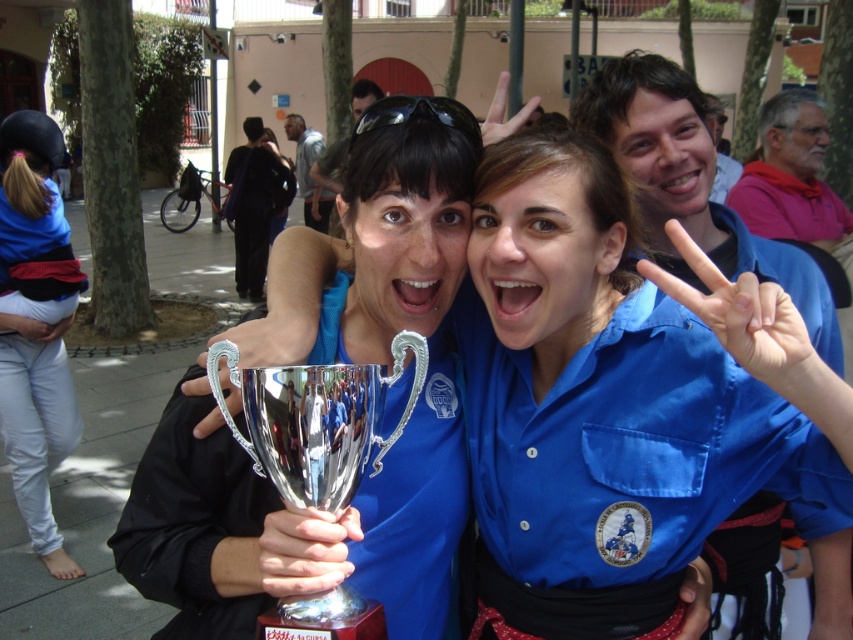
You are a photographer trying to capture a clear photo of the metallic trophy at center and the blue denim pants at lower left. If the trophy is wider than the pants, which object should you focus on to ensure it fits entirely in the frame?

The metallic trophy at center might be wider than blue denim pants at lower left, so you should focus on ensuring the metallic trophy at center fits entirely in the frame since it is wider.

You are a photographer at the event and want to take a closeup shot of the blue denim pants at lower left and the black fabric jacket at center. Which one should you focus on first to ensure it is in sharp focus?

The blue denim pants at lower left is closer to the viewer than the black fabric jacket at center, so you should focus on the blue denim pants at lower left first to ensure it is in sharp focus.